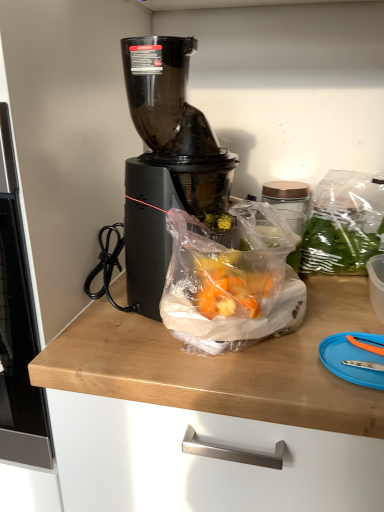
Question: From a real-world perspective, is blue plastic cutting board at lower right above or below black plastic blender at center?

Choices:
 (A) below
 (B) above

Answer: (A)

Question: Looking at the image, does blue plastic cutting board at lower right seem bigger or smaller compared to black plastic blender at center?

Choices:
 (A) small
 (B) big

Answer: (A)

Question: Which is nearer to the translucent plastic bag at center?

Choices:
 (A) black plastic blender at center
 (B) blue plastic cutting board at lower right

Answer: (A)

Question: Which of these objects is positioned closest to the translucent plastic bag at center?

Choices:
 (A) black plastic blender at center
 (B) blue plastic cutting board at lower right

Answer: (A)